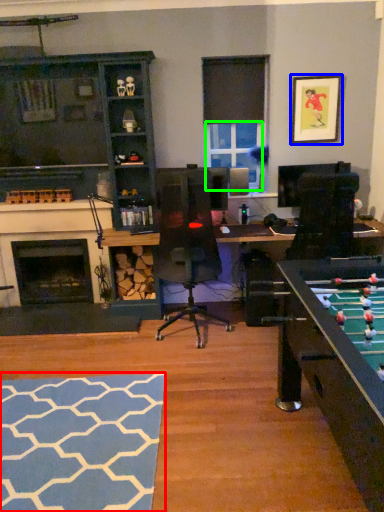
Question: Which object is positioned farthest from flat (highlighted by a red box)? Select from picture frame (highlighted by a blue box) and window screen (highlighted by a green box).

Choices:
 (A) picture frame
 (B) window screen

Answer: (A)